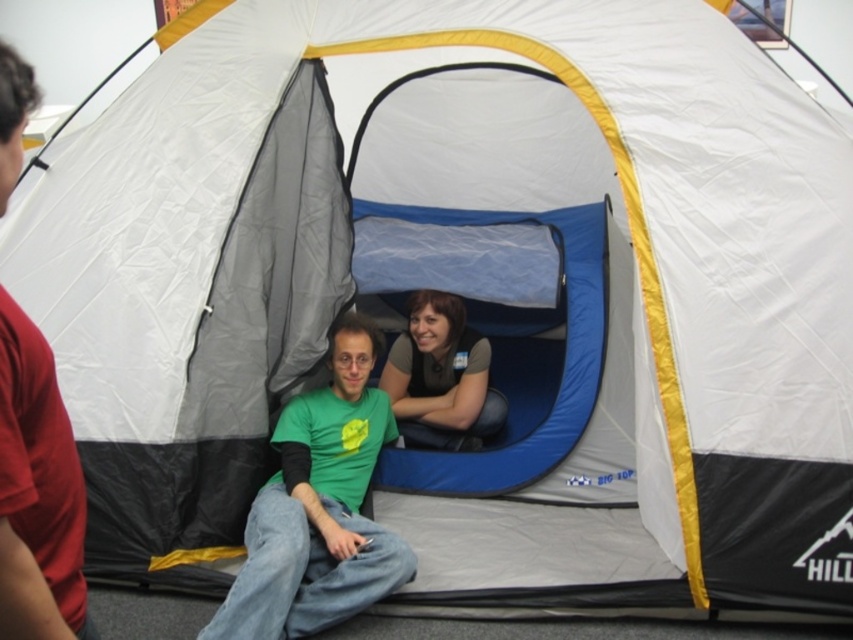
Is point (265, 589) positioned in front of point (454, 445)?

Yes, point (265, 589) is in front of point (454, 445).

Who is positioned more to the right, green matte t-shirt at center or matte blue shirt at center?

matte blue shirt at center

Who is more distant from viewer, (343, 410) or (415, 378)?

Positioned behind is point (415, 378).

Locate an element on the screen. green matte t-shirt at center is located at coordinates (318, 508).

Between green matte t-shirt at center and red cotton t-shirt at left, which one has less height?

green matte t-shirt at center is shorter.

This screenshot has height=640, width=853. Find the location of `green matte t-shirt at center`. green matte t-shirt at center is located at coordinates (318, 508).

Is red cotton t-shirt at left shorter than matte blue shirt at center?

No.

Find the location of a particular element. red cotton t-shirt at left is located at coordinates (38, 492).